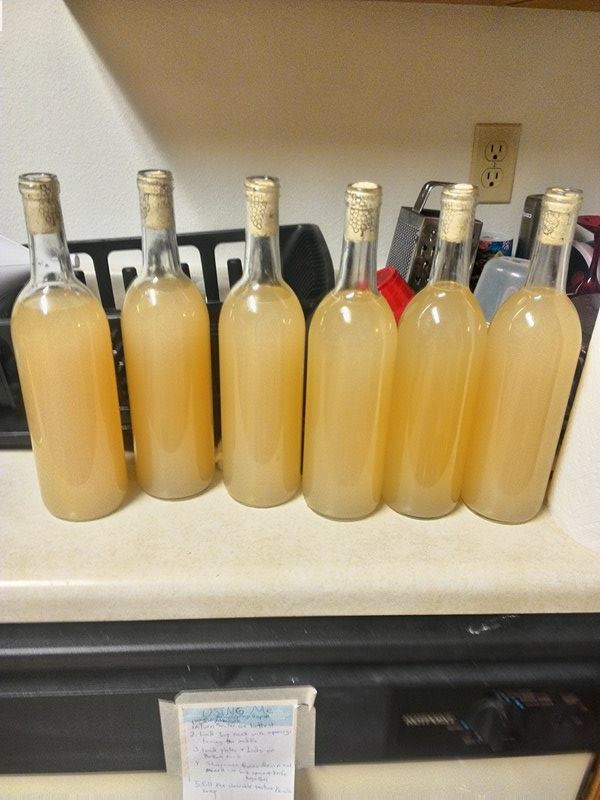
You are a GUI agent. You are given a task and a screenshot of the screen. Output one action in this format:
    pyautogui.click(x=<x>, y=<y>)
    Task: Click on the electrical outlet socket
    This screenshot has width=600, height=800.
    Given the screenshot: What is the action you would take?
    pyautogui.click(x=496, y=154)